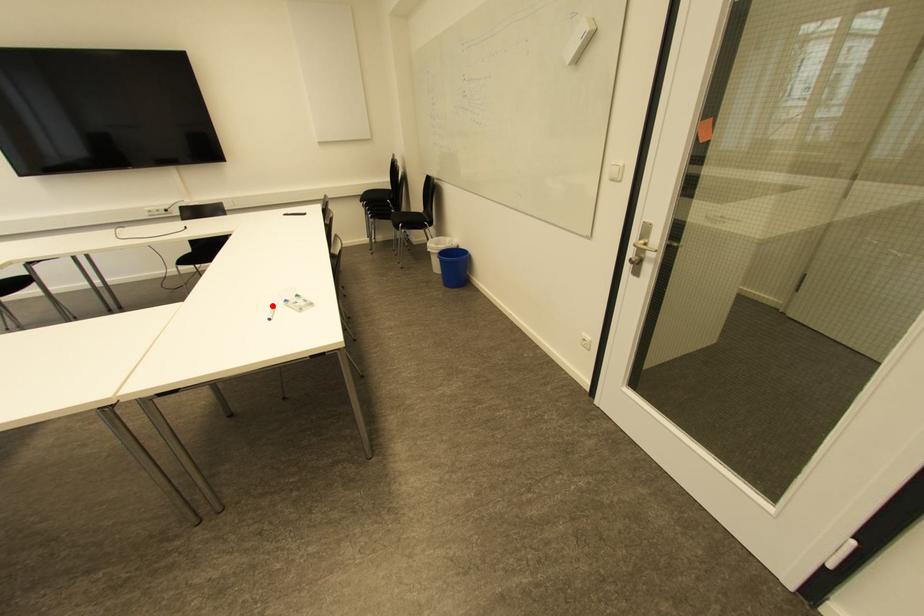
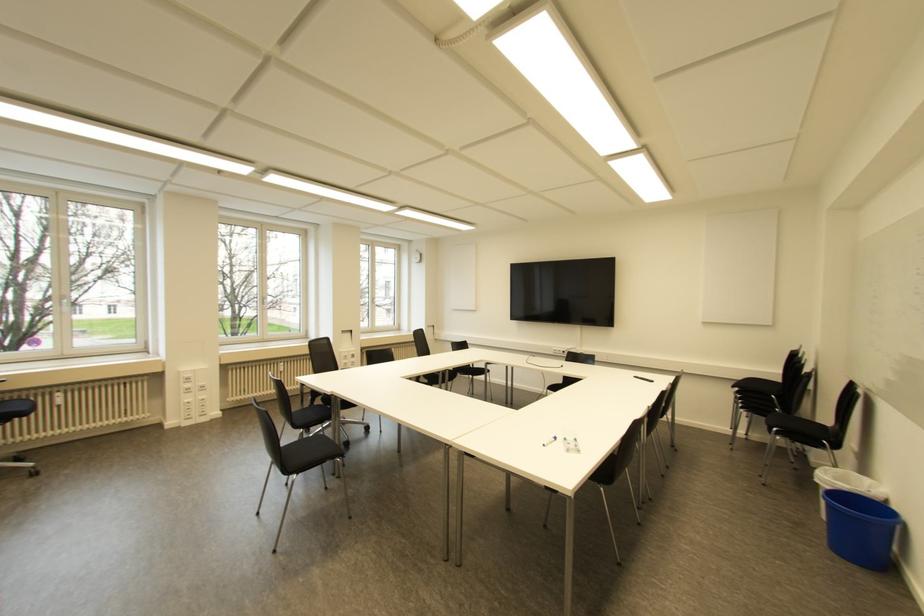
Question: A red point is marked in image1. In image2, is the corresponding 3D point closer to the camera or farther? Reply with the corresponding letter.

Choices:
 (A) The corresponding 3D point is closer.
 (B) The corresponding 3D point is farther.

Answer: (A)